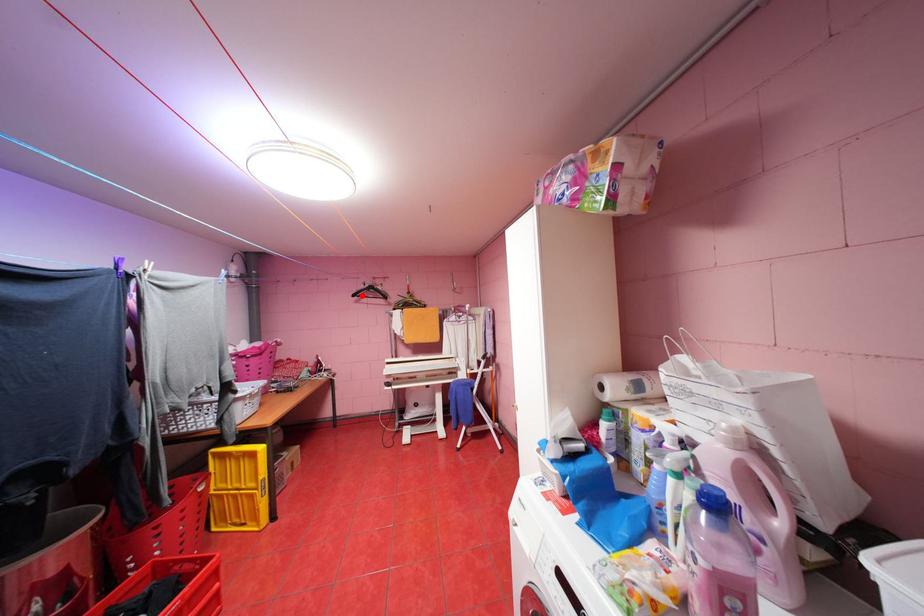
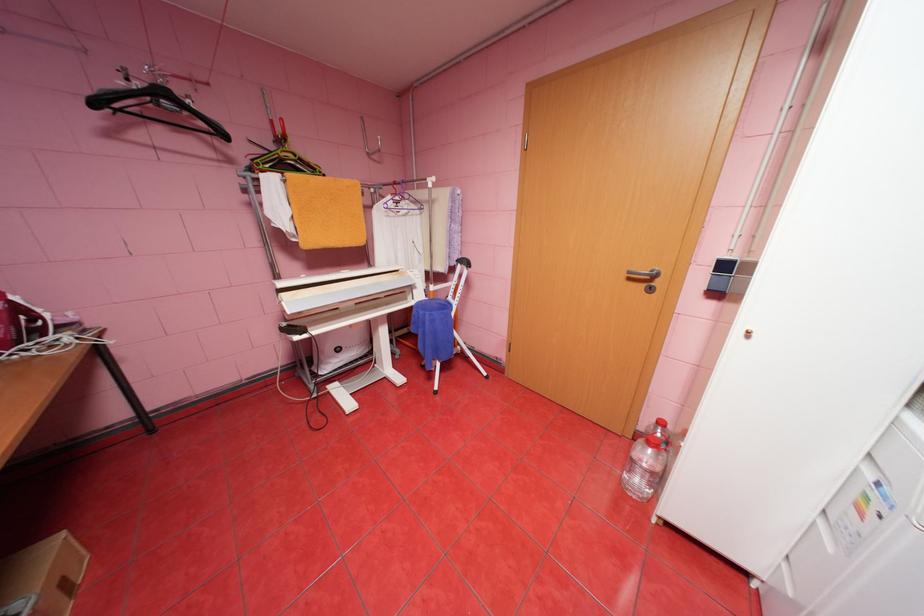
In the second image, find the point that corresponds to the highlighted location in the first image.

(103, 103)